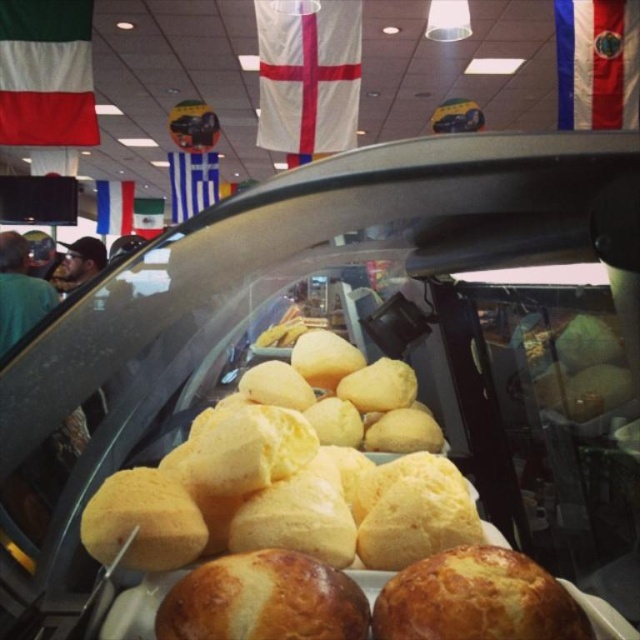
Does point (332, 17) lie in front of point (141, 196)?

Yes, point (332, 17) is closer to viewer.

Between point (282, 131) and point (148, 214), which one is positioned in front?

Point (282, 131) is in front.

Which is behind, point (304, 147) or point (150, 198)?

The point (150, 198) is behind.

Identify the location of white fabric flag at upper center. This screenshot has width=640, height=640. (308, 74).

Who is more distant from viewer, [392,625] or [186,173]?

The point [186,173] is behind.

Is point (419, 576) farther from viewer compared to point (212, 164)?

No, it is in front of (212, 164).

You are a GUI agent. You are given a task and a screenshot of the screen. Output one action in this format:
    pyautogui.click(x=<x>, y=<y>)
    Task: Click on the golden brown crusty bread at center
    The image size is (640, 640).
    Given the screenshot: What is the action you would take?
    pyautogui.click(x=476, y=600)

At what (x,y) coordinates should I click in order to perform the action: click on golden brown crusty bread at center. Please return your answer as a coordinate pair (x, y). This screenshot has height=640, width=640. Looking at the image, I should click on (476, 600).

Does green fabric flag at upper left have a greater height compared to bluematerial/textureflag at center?

No.

Who is more distant from viewer, (29, 109) or (198, 168)?

Positioned behind is point (198, 168).

Does point (38, 20) come closer to viewer compared to point (188, 173)?

Yes, it is in front of point (188, 173).

Identify the location of green fabric flag at upper left. (45, 74).